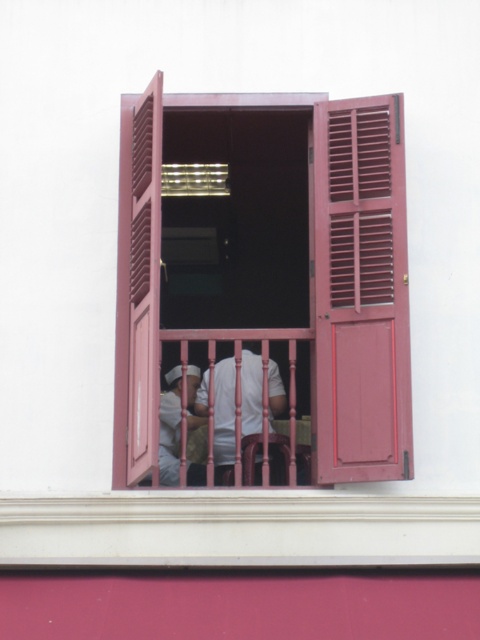
Which is above, matte wood window at center or white matte uniform at center?

matte wood window at center

Consider the image. Is matte wood window at center below white matte uniform at center?

No.

Which is behind, point (379, 202) or point (178, 477)?

The point (178, 477) is behind.

I want to click on matte wood window at center, so click(x=273, y=273).

Find the location of a particular element. This screenshot has width=480, height=640. matte wood shutter at right is located at coordinates (360, 205).

Does matte wood shutter at right have a greater height compared to pink wooden rail at center?

Indeed, matte wood shutter at right has a greater height compared to pink wooden rail at center.

This screenshot has width=480, height=640. What do you see at coordinates (360, 205) in the screenshot?
I see `matte wood shutter at right` at bounding box center [360, 205].

At what (x,y) coordinates should I click in order to perform the action: click on matte wood shutter at right. Please return your answer as a coordinate pair (x, y). Looking at the image, I should click on (360, 205).

Locate an element on the screen. matte wood window at center is located at coordinates (273, 273).

Which is below, matte wood window at center or matte wood shutter at right?

matte wood window at center

Find the location of a particular element. matte wood window at center is located at coordinates (273, 273).